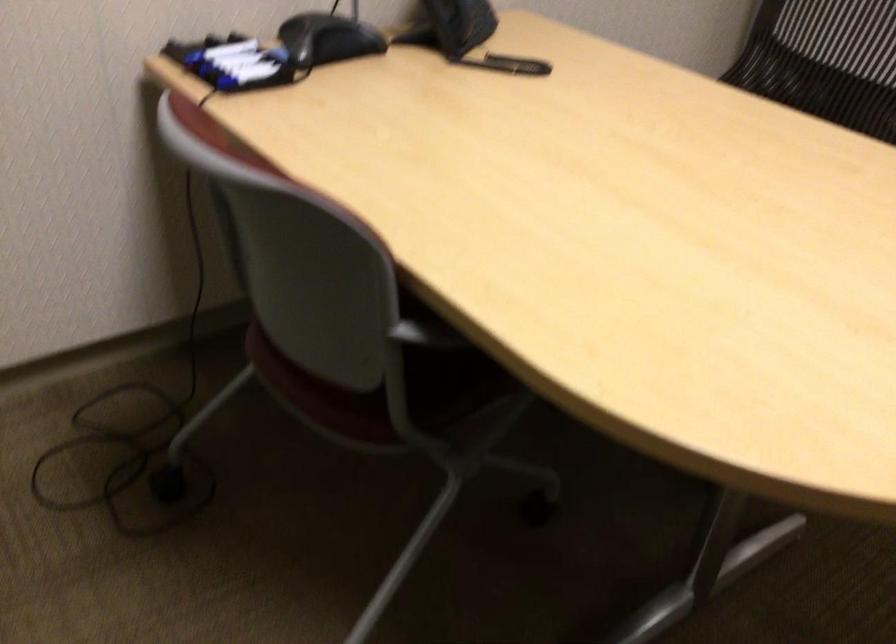
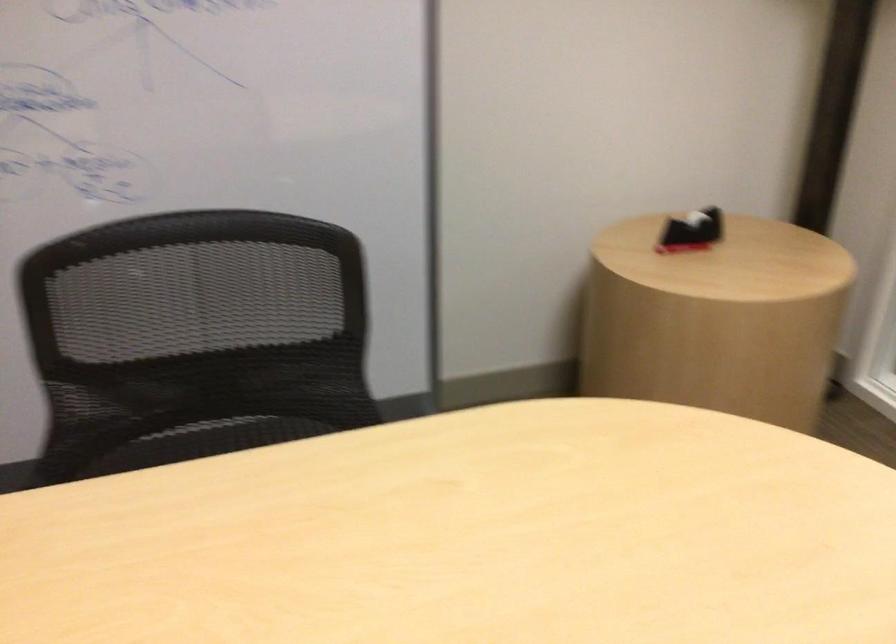
Locate, in the second image, the point that corresponds to point (812, 120) in the first image.

(218, 438)